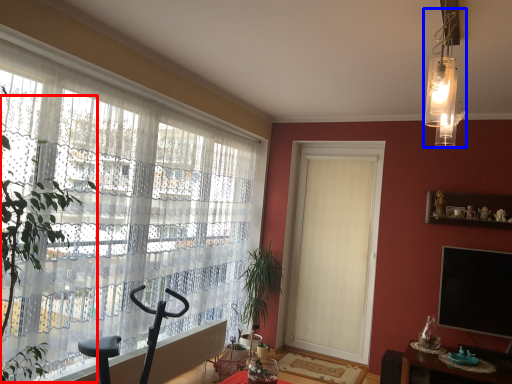
Question: Which point is closer to the camera, tree (highlighted by a red box) or light fixture (highlighted by a blue box)?

Choices:
 (A) tree
 (B) light fixture

Answer: (A)